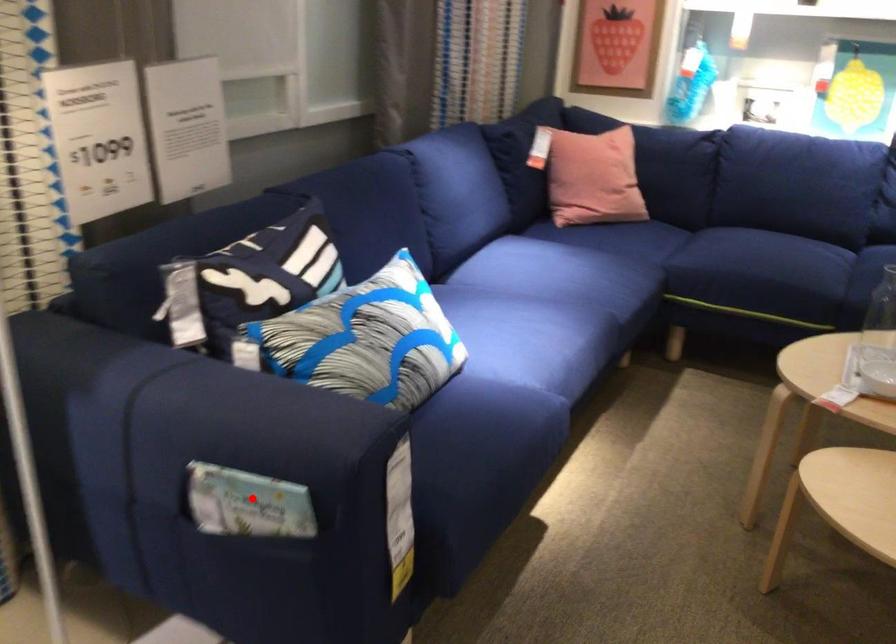
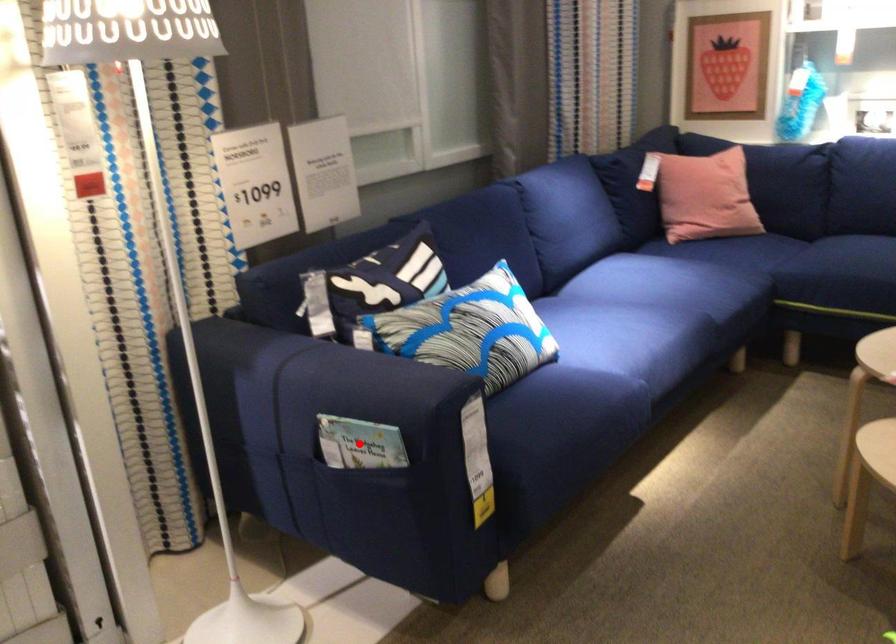
I am providing you with two images of the same scene from different viewpoints. A red point is marked on the first image and another point is marked on the second image. Are the points marked in image1 and image2 representing the same 3D position?

Yes